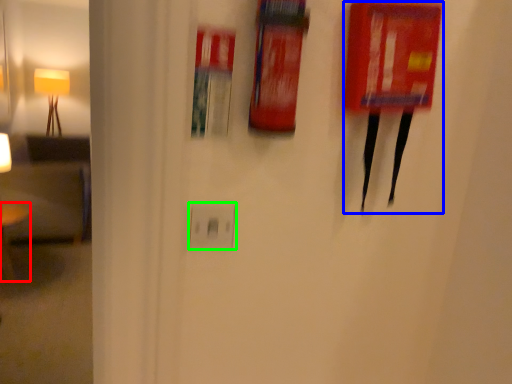
Question: Which object is positioned closest to furniture (highlighted by a red box)? Select from wide (highlighted by a blue box) and electric outlet (highlighted by a green box).

Choices:
 (A) wide
 (B) electric outlet

Answer: (B)